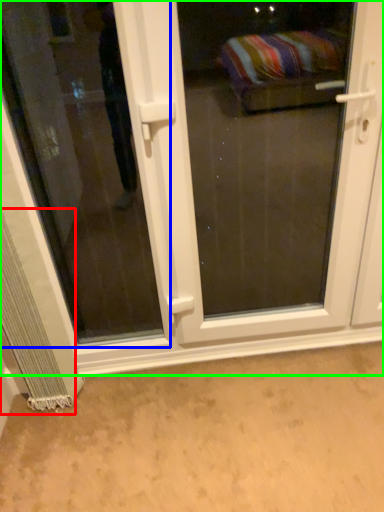
Question: Considering the real-world distances, which object is farthest from curtain (highlighted by a red box)? window (highlighted by a blue box) or door (highlighted by a green box)?

Choices:
 (A) window
 (B) door

Answer: (A)